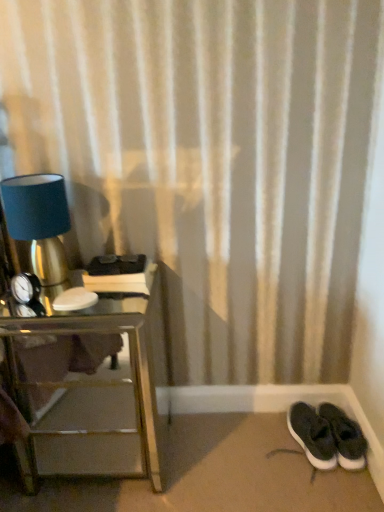
Locate an element on the screen. The height and width of the screenshot is (512, 384). free spot to the right of silver mirrored nightstand at left is located at coordinates (216, 457).